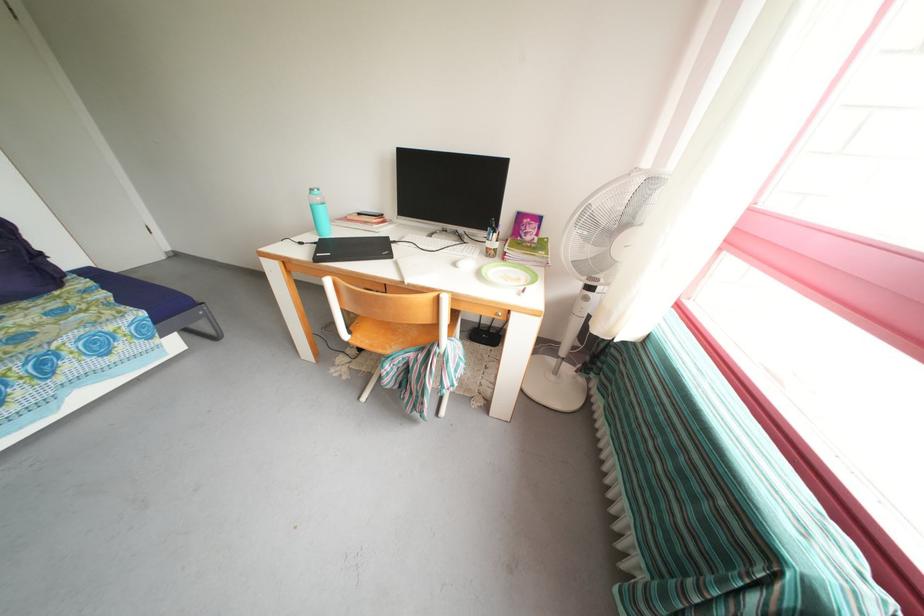
Find the location of a particular element. The image size is (924, 616). water bottle cap is located at coordinates (314, 197).